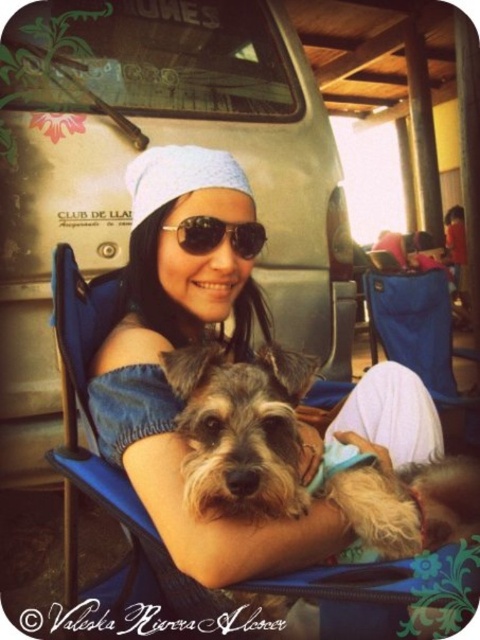
Is blue fabric chair at center shorter than blue fabric folding chair at lower right?

Indeed, blue fabric chair at center has a lesser height compared to blue fabric folding chair at lower right.

Between point (70, 392) and point (448, 401), which one is positioned behind?

Point (448, 401)

Is point (418, 586) positioned after point (423, 314)?

That is False.

You are a GUI agent. You are given a task and a screenshot of the screen. Output one action in this format:
    pyautogui.click(x=<x>, y=<y>)
    Task: Click on the blue fabric chair at center
    
    Given the screenshot: What is the action you would take?
    click(82, 392)

Between point (422, 282) and point (242, 225), which one is positioned in front?

Point (242, 225) is more forward.

Measure the distance between blue fabric folding chair at lower right and sunglasses at center.

blue fabric folding chair at lower right and sunglasses at center are 1.30 meters apart.

Describe the element at coordinates (420, 337) in the screenshot. Image resolution: width=480 pixels, height=640 pixels. I see `blue fabric folding chair at lower right` at that location.

You are a GUI agent. You are given a task and a screenshot of the screen. Output one action in this format:
    pyautogui.click(x=<x>, y=<y>)
    Task: Click on the blue fabric folding chair at lower right
    The height and width of the screenshot is (640, 480).
    Given the screenshot: What is the action you would take?
    pyautogui.click(x=420, y=337)

Is point (239, 465) positioned before point (380, 326)?

That is True.

Is fuzzy brown dog at center positioned behind blue fabric folding chair at lower right?

No, fuzzy brown dog at center is in front of blue fabric folding chair at lower right.

Between point (294, 392) and point (412, 321), which one is positioned in front?

Point (294, 392)

This screenshot has width=480, height=640. What are the coordinates of `fuzzy brown dog at center` in the screenshot? It's located at (240, 428).